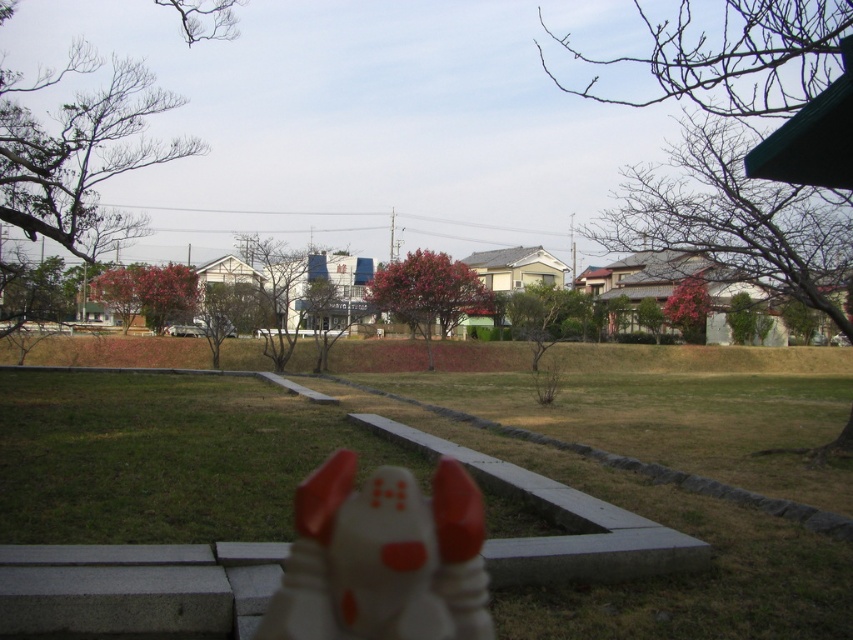
Question: Is green grass at center behind white matte dog at center?

Choices:
 (A) yes
 (B) no

Answer: (A)

Question: Does green grass at center appear on the left side of white matte dog at center?

Choices:
 (A) yes
 (B) no

Answer: (A)

Question: Which point is closer to the camera taking this photo?

Choices:
 (A) (416, 612)
 (B) (792, 497)

Answer: (A)

Question: Can you confirm if green grass at center is wider than white matte dog at center?

Choices:
 (A) yes
 (B) no

Answer: (A)